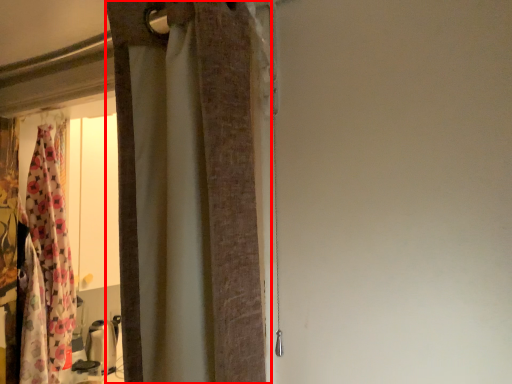
Question: Observing the image, what is the correct spatial positioning of curtain (annotated by the red box) in reference to curtain?

Choices:
 (A) right
 (B) left

Answer: (A)